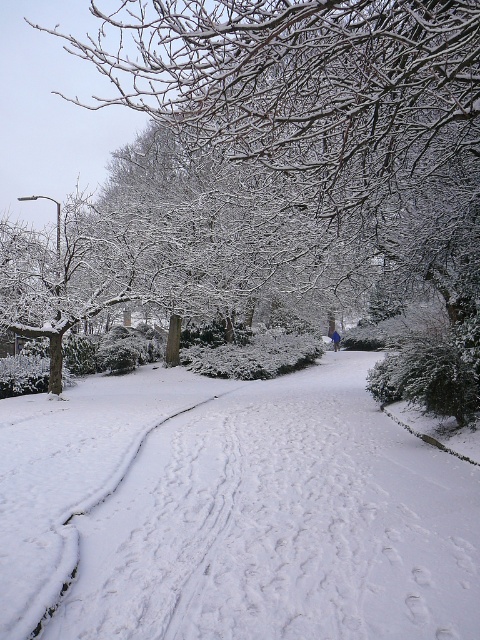
You are standing at the center of the winter scene and want to place a small snowman exactly at point (232,513). Is there enough space to build it there?

At point (232,513) lies white fluffy snow at center, so yes, there is enough space to build the snowman there since the area is covered with snow.